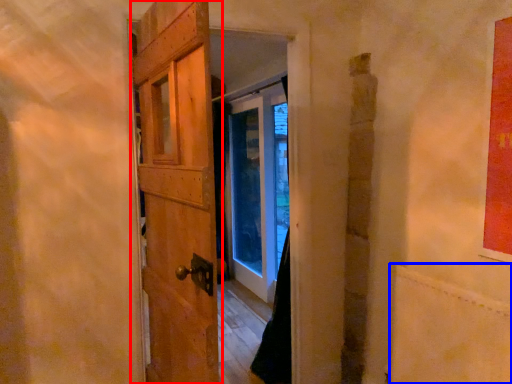
Question: Which object is closer to the camera taking this photo, door (highlighted by a red box) or plywood (highlighted by a blue box)?

Choices:
 (A) door
 (B) plywood

Answer: (A)